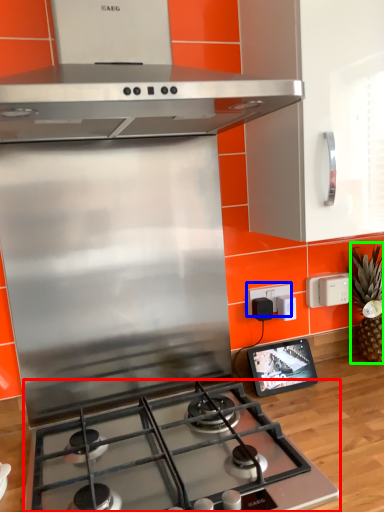
Question: Based on their relative distances, which object is farther from gas stove (highlighted by a red box)? Choose from electric outlet (highlighted by a blue box) and pineapple (highlighted by a green box).

Choices:
 (A) electric outlet
 (B) pineapple

Answer: (B)